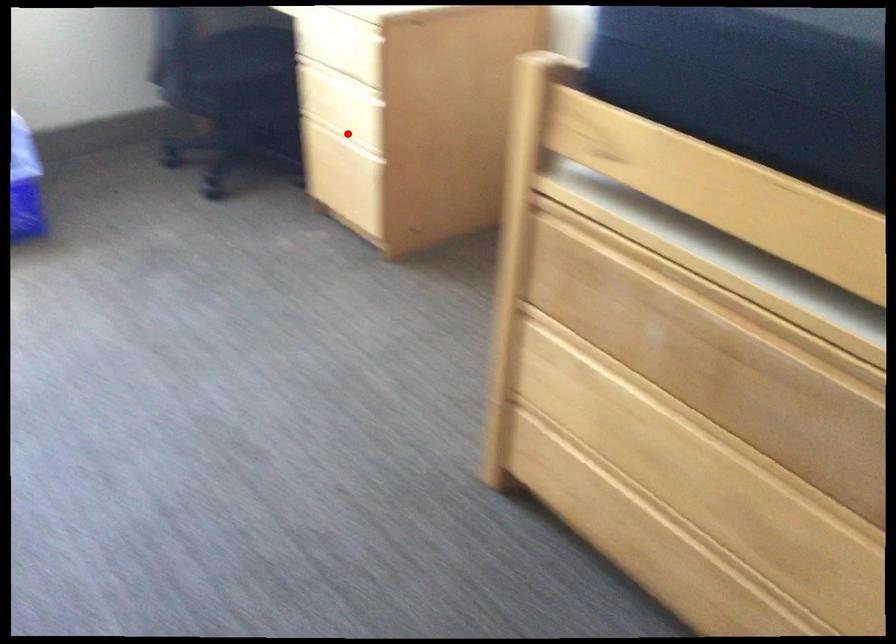
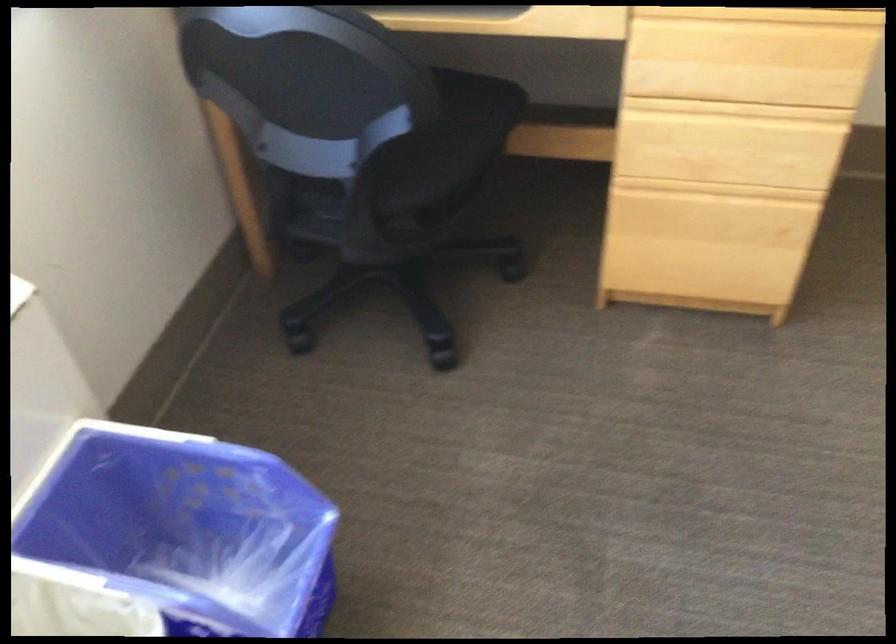
Where in the second image is the point corresponding to the highlighted location from the first image?

(718, 190)